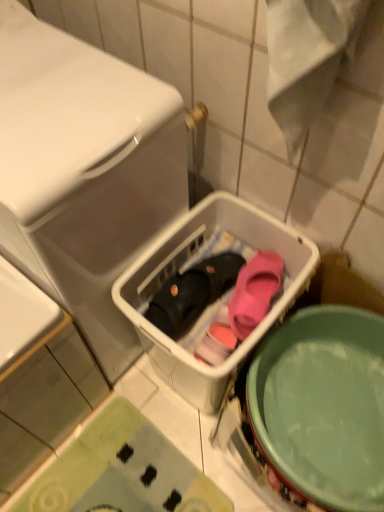
Identify the location of green matte mixing bowl at lower right. Image resolution: width=384 pixels, height=512 pixels. (323, 405).

Describe the element at coordinates (84, 172) in the screenshot. I see `white glossy dishwasher at upper left, arranged as the first dish washer when viewed from the left` at that location.

The image size is (384, 512). I want to click on black matte slipper at center, which is the 1th footwear in left-to-right order, so click(193, 293).

What do you see at coordinates (219, 298) in the screenshot? Image resolution: width=384 pixels, height=512 pixels. I see `white plastic basket at center, the 1th dish washer when ordered from right to left` at bounding box center [219, 298].

This screenshot has width=384, height=512. In order to click on green textured bath mat at lower left in this screenshot , I will do `click(120, 471)`.

Find the location of a particular element. The height and width of the screenshot is (512, 384). green matte mixing bowl at lower right is located at coordinates (323, 405).

Which object is thinner, black matte slipper at center, which is the 1th footwear in left-to-right order, or pink matte slipper at center, the second footwear from the left?

pink matte slipper at center, the second footwear from the left.

Is the surface of black matte slipper at center, the second footwear positioned from the right, in direct contact with pink matte slipper at center, the second footwear from the left?

black matte slipper at center, the second footwear positioned from the right, is not next to pink matte slipper at center, the second footwear from the left, and they're not touching.

Does point (180, 330) appear closer or farther from the camera than point (240, 274)?

Point (180, 330) is closer to the camera than point (240, 274).

Would you say black matte slipper at center, which is the 1th footwear in left-to-right order, is to the left or to the right of pink matte slipper at center, which ranks as the first footwear in right-to-left order, in the picture?

black matte slipper at center, which is the 1th footwear in left-to-right order, is positioned on pink matte slipper at center, which ranks as the first footwear in right-to-left order,'s left side.

Is point (320, 328) closer or farther from the camera than point (132, 321)?

Point (320, 328) is positioned farther from the camera compared to point (132, 321).

In the scene shown: From the image's perspective, between green matte mixing bowl at lower right and white plastic basket at center, the 1th dish washer when ordered from right to left, which one is located above?

white plastic basket at center, the 1th dish washer when ordered from right to left, from the image's perspective.

In the scene shown: Can white plastic basket at center, the 1th dish washer when ordered from right to left, be found inside green matte mixing bowl at lower right?

No, white plastic basket at center, the 1th dish washer when ordered from right to left, is not a part of green matte mixing bowl at lower right.

What are the coordinates of `mixing bowl above the white plastic basket at center, which ranks as the second dish washer in left-to-right order (from a real-world perspective)` in the screenshot? It's located at click(x=323, y=405).

Can you confirm if pink matte slipper at center, which ranks as the first footwear in right-to-left order, is smaller than green matte mixing bowl at lower right?

Yes.

Locate an element on the screen. mixing bowl in front of the pink matte slipper at center, which ranks as the first footwear in right-to-left order is located at coordinates (323, 405).

Considering the relative sizes of pink matte slipper at center, which ranks as the first footwear in right-to-left order, and green matte mixing bowl at lower right in the image provided, is pink matte slipper at center, which ranks as the first footwear in right-to-left order, shorter than green matte mixing bowl at lower right?

Yes.

Is pink matte slipper at center, which ranks as the first footwear in right-to-left order, to the left of green matte mixing bowl at lower right from the viewer's perspective?

Indeed, pink matte slipper at center, which ranks as the first footwear in right-to-left order, is positioned on the left side of green matte mixing bowl at lower right.

Locate an element on the screen. The image size is (384, 512). dish washer above the pink matte slipper at center, which ranks as the first footwear in right-to-left order (from the image's perspective) is located at coordinates (84, 172).

Based on the photo, between pink matte slipper at center, which ranks as the first footwear in right-to-left order, and white glossy dishwasher at upper left, arranged as the first dish washer when viewed from the left, which one has less height?

pink matte slipper at center, which ranks as the first footwear in right-to-left order.

Between pink matte slipper at center, which ranks as the first footwear in right-to-left order, and white glossy dishwasher at upper left, arranged as the first dish washer when viewed from the left, which one appears on the right side from the viewer's perspective?

pink matte slipper at center, which ranks as the first footwear in right-to-left order.

Which object is further away from the camera, pink matte slipper at center, the second footwear from the left, or white glossy dishwasher at upper left, arranged as the first dish washer when viewed from the left?

pink matte slipper at center, the second footwear from the left, is further from the camera.

Is white plastic basket at center, which ranks as the second dish washer in left-to-right order, positioned beyond the bounds of white glossy dishwasher at upper left, which is counted as the 2th dish washer, starting from the right?

Indeed, white plastic basket at center, which ranks as the second dish washer in left-to-right order, is completely outside white glossy dishwasher at upper left, which is counted as the 2th dish washer, starting from the right.

This screenshot has width=384, height=512. There is a white plastic basket at center, the 1th dish washer when ordered from right to left. Find the location of `dish washer above it (from a real-world perspective)`. dish washer above it (from a real-world perspective) is located at coordinates (84, 172).

Is white plastic basket at center, which ranks as the second dish washer in left-to-right order, oriented away from white glossy dishwasher at upper left, arranged as the first dish washer when viewed from the left?

No, white plastic basket at center, which ranks as the second dish washer in left-to-right order, is not facing the opposite direction of white glossy dishwasher at upper left, arranged as the first dish washer when viewed from the left.

Does black matte slipper at center, the second footwear positioned from the right, lie behind green matte mixing bowl at lower right?

Yes, the depth of black matte slipper at center, the second footwear positioned from the right, is greater than that of green matte mixing bowl at lower right.

Starting from the green matte mixing bowl at lower right, which footwear is the 2nd one behind? Please provide its 2D coordinates.

[(193, 293)]

Considering the points (154, 316) and (347, 384), which point is in front, point (154, 316) or point (347, 384)?

The point (154, 316) is closer.

Is green matte mixing bowl at lower right touching green textured bath mat at lower left?

There is a gap between green matte mixing bowl at lower right and green textured bath mat at lower left.

Is green matte mixing bowl at lower right to the right of green textured bath mat at lower left from the viewer's perspective?

Yes, green matte mixing bowl at lower right is to the right of green textured bath mat at lower left.

From a real-world perspective, which object stands above the other?

From a 3D spatial view, green matte mixing bowl at lower right is above.

Does point (375, 407) appear closer or farther from the camera than point (128, 493)?

Point (375, 407) appears to be closer to the viewer than point (128, 493).

Find the location of a particular element. footwear above the pink matte slipper at center, the second footwear from the left (from the image's perspective) is located at coordinates (193, 293).

Find the location of a particular element. mixing bowl in front of the white plastic basket at center, which ranks as the second dish washer in left-to-right order is located at coordinates pyautogui.click(x=323, y=405).

From the image, which object appears to be nearer to black matte slipper at center, which is the 1th footwear in left-to-right order, white glossy dishwasher at upper left, which is counted as the 2th dish washer, starting from the right, or green matte mixing bowl at lower right?

Among the two, white glossy dishwasher at upper left, which is counted as the 2th dish washer, starting from the right, is located nearer to black matte slipper at center, which is the 1th footwear in left-to-right order.

From the image, which object appears to be nearer to black matte slipper at center, the second footwear positioned from the right, white plastic basket at center, the 1th dish washer when ordered from right to left, or green textured bath mat at lower left?

The object closer to black matte slipper at center, the second footwear positioned from the right, is white plastic basket at center, the 1th dish washer when ordered from right to left.

When comparing their distances from green matte mixing bowl at lower right, does white glossy dishwasher at upper left, arranged as the first dish washer when viewed from the left, or white plastic basket at center, which ranks as the second dish washer in left-to-right order, seem closer?

white plastic basket at center, which ranks as the second dish washer in left-to-right order, is positioned closer to the anchor green matte mixing bowl at lower right.

Which object lies further to the anchor point green textured bath mat at lower left, white plastic basket at center, which ranks as the second dish washer in left-to-right order, or black matte slipper at center, the second footwear positioned from the right?

black matte slipper at center, the second footwear positioned from the right.

Looking at the image, which one is located closer to green textured bath mat at lower left, white plastic basket at center, the 1th dish washer when ordered from right to left, or pink matte slipper at center, which ranks as the first footwear in right-to-left order?

white plastic basket at center, the 1th dish washer when ordered from right to left, lies closer to green textured bath mat at lower left than the other object.

Based on their spatial positions, is white glossy dishwasher at upper left, arranged as the first dish washer when viewed from the left, or black matte slipper at center, the second footwear positioned from the right, closer to pink matte slipper at center, the second footwear from the left?

black matte slipper at center, the second footwear positioned from the right.

From the image, which object appears to be farther from black matte slipper at center, the second footwear positioned from the right, green matte mixing bowl at lower right or pink matte slipper at center, which ranks as the first footwear in right-to-left order?

Among the two, green matte mixing bowl at lower right is located further to black matte slipper at center, the second footwear positioned from the right.

Looking at the image, which one is located closer to green matte mixing bowl at lower right, white plastic basket at center, the 1th dish washer when ordered from right to left, or green textured bath mat at lower left?

The object closer to green matte mixing bowl at lower right is white plastic basket at center, the 1th dish washer when ordered from right to left.

Where is `footwear situated between white glossy dishwasher at upper left, arranged as the first dish washer when viewed from the left, and pink matte slipper at center, which ranks as the first footwear in right-to-left order, from left to right`? footwear situated between white glossy dishwasher at upper left, arranged as the first dish washer when viewed from the left, and pink matte slipper at center, which ranks as the first footwear in right-to-left order, from left to right is located at coordinates (193, 293).

Where is `dish washer between green textured bath mat at lower left and green matte mixing bowl at lower right`? dish washer between green textured bath mat at lower left and green matte mixing bowl at lower right is located at coordinates (219, 298).

Locate an element on the screen. dish washer between pink matte slipper at center, the second footwear from the left, and green matte mixing bowl at lower right, in the vertical direction is located at coordinates (219, 298).

Where is `footwear located between white plastic basket at center, which ranks as the second dish washer in left-to-right order, and black matte slipper at center, which is the 1th footwear in left-to-right order, in the depth direction`? footwear located between white plastic basket at center, which ranks as the second dish washer in left-to-right order, and black matte slipper at center, which is the 1th footwear in left-to-right order, in the depth direction is located at coordinates (254, 292).